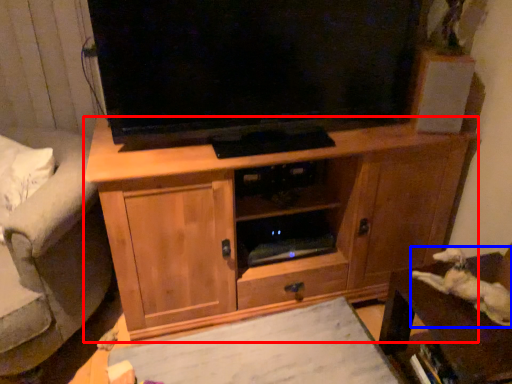
Question: Among these objects, which one is nearest to the camera, cabinetry (highlighted by a red box) or animal (highlighted by a blue box)?

Choices:
 (A) cabinetry
 (B) animal

Answer: (B)